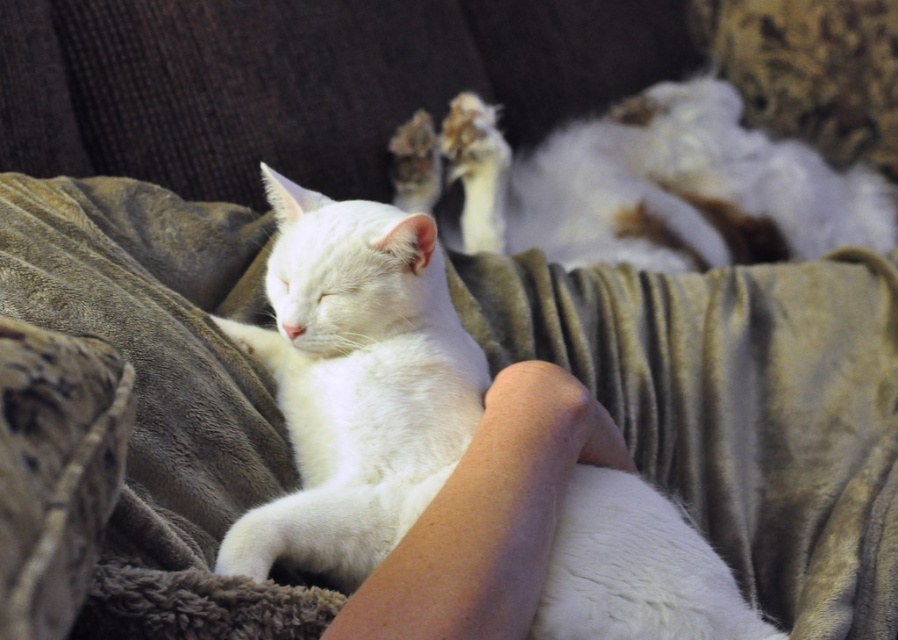
Locate an element on the screen. white fluffy cat at center is located at coordinates (354, 381).

The image size is (898, 640). What do you see at coordinates (354, 381) in the screenshot?
I see `white fluffy cat at center` at bounding box center [354, 381].

Who is more distant from viewer, (643, 541) or (861, 188)?

Positioned behind is point (861, 188).

The height and width of the screenshot is (640, 898). Find the location of `white fluffy cat at center`. white fluffy cat at center is located at coordinates (354, 381).